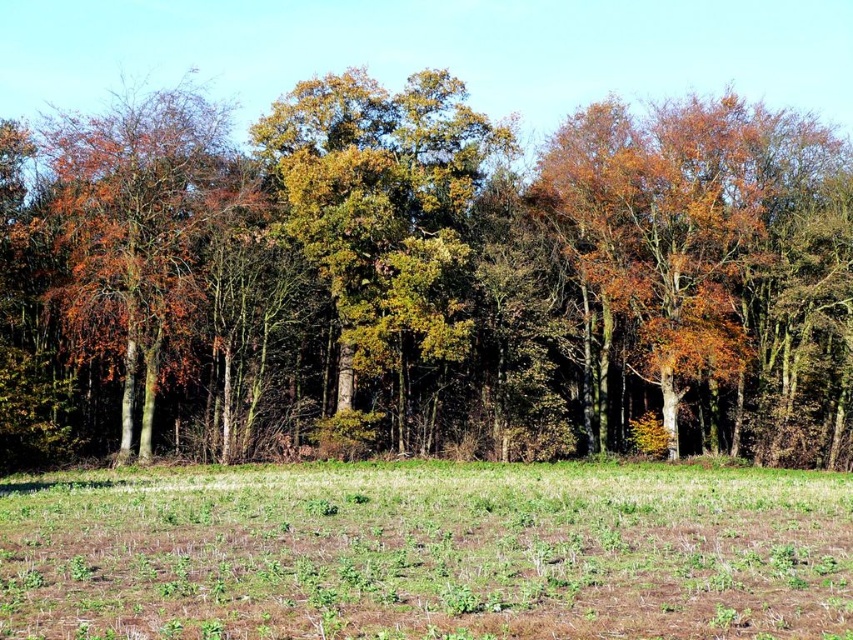
Question: Does green grass at lower center have a lesser width compared to orange-brown bark tree at left?

Choices:
 (A) yes
 (B) no

Answer: (B)

Question: Does green leafy trees at center have a larger size compared to green grass at lower center?

Choices:
 (A) no
 (B) yes

Answer: (B)

Question: Based on their relative distances, which object is farther from the orange-brown bark tree at left?

Choices:
 (A) green leafy trees at center
 (B) green leafy tree at center

Answer: (A)

Question: Is green leafy tree at center in front of orange-brown bark tree at left?

Choices:
 (A) no
 (B) yes

Answer: (A)

Question: Which is nearer to the green grass at lower center?

Choices:
 (A) green leafy tree at center
 (B) orange-brown bark tree at left
 (C) green leafy trees at center

Answer: (B)

Question: Which point appears farthest from the camera in this image?

Choices:
 (A) (418, 81)
 (B) (515, 545)

Answer: (A)